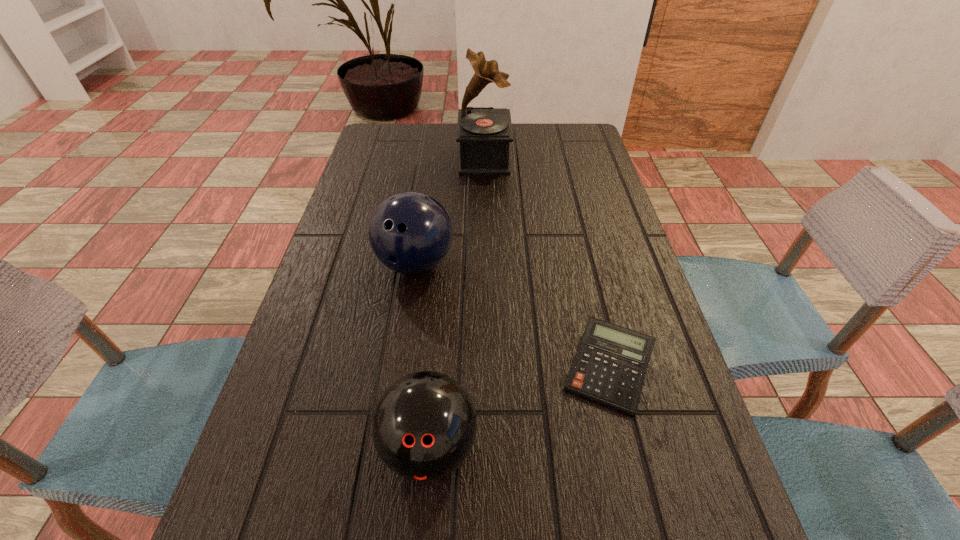
Where is `vacant region that satisfies the following two spatial constraints: 1. at the horn opening of the tallest object; 2. on the surface of the farther bowling ball near the finger holes`? vacant region that satisfies the following two spatial constraints: 1. at the horn opening of the tallest object; 2. on the surface of the farther bowling ball near the finger holes is located at coordinates (486, 264).

In order to click on vacant space that satisfies the following two spatial constraints: 1. at the horn opening of the tallest object; 2. on the right side of the shortest object in this screenshot , I will do `click(487, 368)`.

Identify the location of vacant space that satisfies the following two spatial constraints: 1. at the horn opening of the calculator; 2. on the left side of the farthest object. This screenshot has width=960, height=540. (487, 368).

Find the location of `free space in the image that satisfies the following two spatial constraints: 1. at the horn opening of the farthest object; 2. on the surface of the second farthest object near the finger holes`. free space in the image that satisfies the following two spatial constraints: 1. at the horn opening of the farthest object; 2. on the surface of the second farthest object near the finger holes is located at coordinates (486, 264).

The width and height of the screenshot is (960, 540). I want to click on free space that satisfies the following two spatial constraints: 1. on the surface of the shortest object near the finger holes; 2. on the right side of the farther bowling ball, so click(x=399, y=368).

The image size is (960, 540). What are the coordinates of `blank area in the image that satisfies the following two spatial constraints: 1. at the horn opening of the shortest object; 2. on the left side of the farthest object` in the screenshot? It's located at (487, 368).